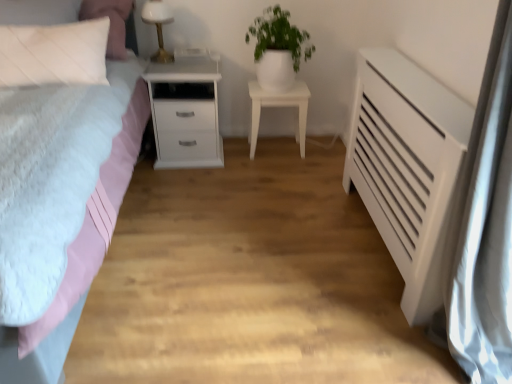
The height and width of the screenshot is (384, 512). Identify the location of free region under white matte radiator at right (from a real-world perspective). (424, 345).